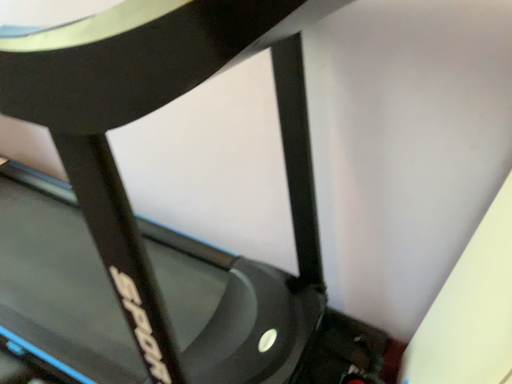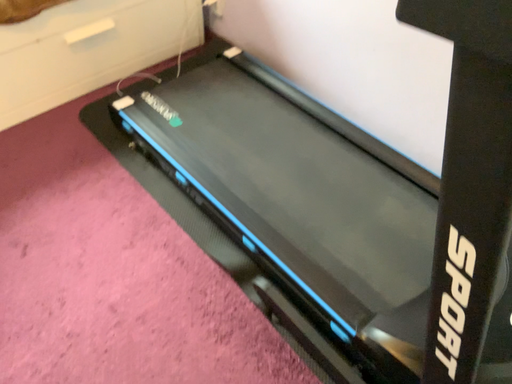
Question: Which way did the camera rotate in the video?

Choices:
 (A) rotated downward
 (B) rotated upward

Answer: (A)